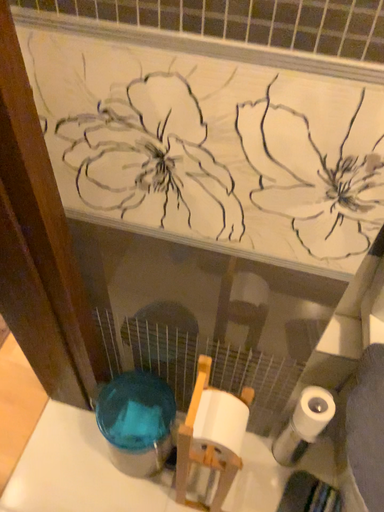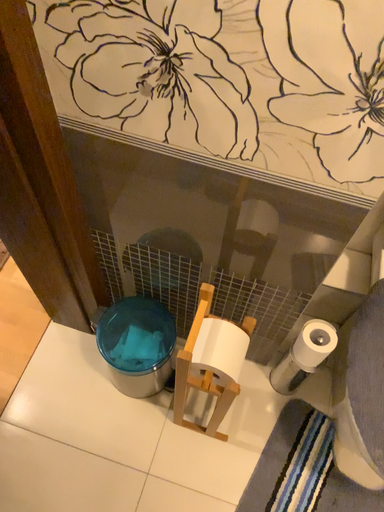
Question: How did the camera likely rotate when shooting the video?

Choices:
 (A) rotated downward
 (B) rotated upward

Answer: (A)